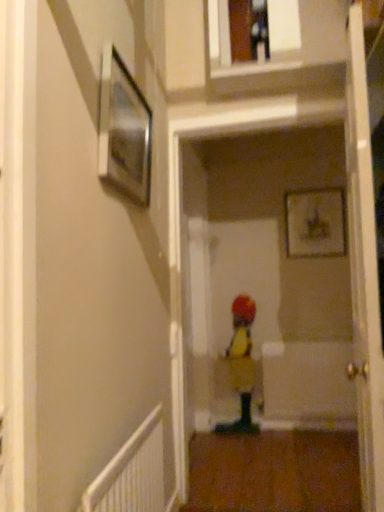
Question: Is wooden framed picture at upper center, the second picture frame when ordered from front to back, facing towards white glossy door at center?

Choices:
 (A) no
 (B) yes

Answer: (B)

Question: Is the depth of wooden framed picture at upper center, which is counted as the 1th picture frame, starting from the back, less than that of white glossy door at center?

Choices:
 (A) no
 (B) yes

Answer: (A)

Question: Does wooden framed picture at upper center, the second picture frame when ordered from left to right, contain white glossy door at center?

Choices:
 (A) no
 (B) yes

Answer: (A)

Question: Can you confirm if wooden framed picture at upper center, marked as the first picture frame in a right-to-left arrangement, is shorter than white glossy door at center?

Choices:
 (A) yes
 (B) no

Answer: (A)

Question: Can you confirm if wooden framed picture at upper center, the second picture frame when ordered from front to back, is positioned to the right of white glossy door at center?

Choices:
 (A) no
 (B) yes

Answer: (B)

Question: From the image's perspective, is wooden framed picture at upper center, the second picture frame when ordered from left to right, under white glossy door at center?

Choices:
 (A) yes
 (B) no

Answer: (B)

Question: Is metallic silver picture frame at upper left, which is counted as the first picture frame, starting from the left, far from white textured radiator at lower left?

Choices:
 (A) no
 (B) yes

Answer: (B)

Question: From the image's perspective, is metallic silver picture frame at upper left, which appears as the second picture frame when viewed from the back, above white textured radiator at lower left?

Choices:
 (A) yes
 (B) no

Answer: (A)

Question: Is metallic silver picture frame at upper left, which appears as the second picture frame when viewed from the back, thinner than white textured radiator at lower left?

Choices:
 (A) no
 (B) yes

Answer: (B)

Question: Can you confirm if metallic silver picture frame at upper left, acting as the second picture frame starting from the right, is wider than white textured radiator at lower left?

Choices:
 (A) yes
 (B) no

Answer: (B)

Question: From a real-world perspective, is metallic silver picture frame at upper left, acting as the second picture frame starting from the right, located beneath white textured radiator at lower left?

Choices:
 (A) yes
 (B) no

Answer: (B)

Question: Does metallic silver picture frame at upper left, positioned as the first picture frame in front-to-back order, have a greater height compared to white textured radiator at lower left?

Choices:
 (A) no
 (B) yes

Answer: (A)

Question: Does yellow fabric toddler at center have a greater width compared to white textured radiator at lower left?

Choices:
 (A) yes
 (B) no

Answer: (A)